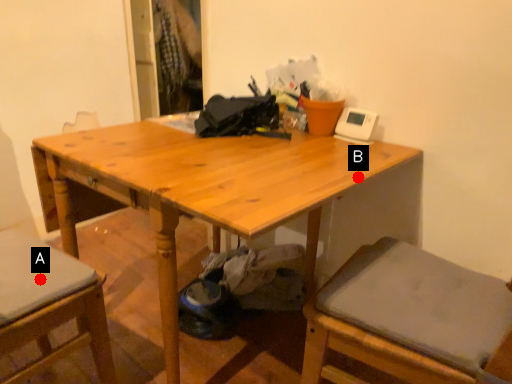
Question: Two points are circled on the image, labeled by A and B beside each circle. Which of the following is the closest to the observer?

Choices:
 (A) A is closer
 (B) B is closer

Answer: (A)